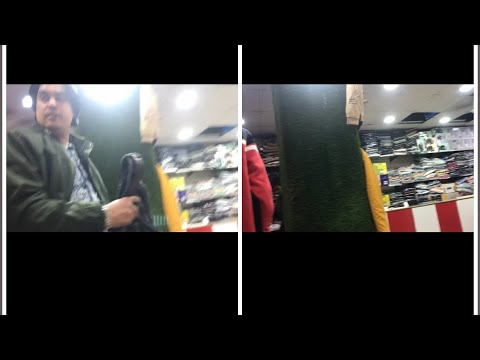
This screenshot has height=360, width=480. In order to click on lights in this screenshot , I will do `click(178, 96)`, `click(180, 128)`, `click(110, 88)`, `click(24, 101)`, `click(387, 116)`, `click(392, 86)`, `click(467, 89)`, `click(443, 120)`.